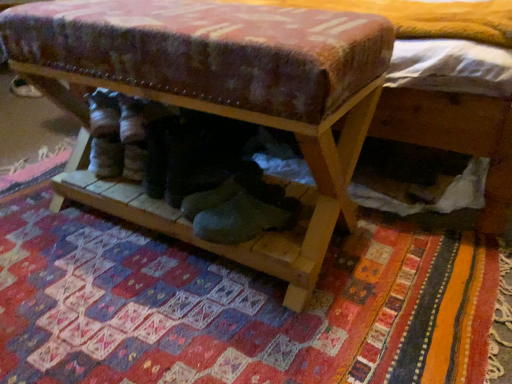
Question: Considering the relative positions of white suede shoe at lower left and wooden shoe rack at center in the image provided, is white suede shoe at lower left in front of wooden shoe rack at center?

Choices:
 (A) yes
 (B) no

Answer: (B)

Question: Considering the relative positions of white suede shoe at lower left and wooden shoe rack at center in the image provided, is white suede shoe at lower left to the right of wooden shoe rack at center from the viewer's perspective?

Choices:
 (A) yes
 (B) no

Answer: (B)

Question: From a real-world perspective, does white suede shoe at lower left stand above wooden shoe rack at center?

Choices:
 (A) yes
 (B) no

Answer: (B)

Question: Considering the relative sizes of white suede shoe at lower left and wooden shoe rack at center in the image provided, is white suede shoe at lower left bigger than wooden shoe rack at center?

Choices:
 (A) no
 (B) yes

Answer: (A)

Question: Is white suede shoe at lower left positioned beyond the bounds of wooden shoe rack at center?

Choices:
 (A) yes
 (B) no

Answer: (A)

Question: Does white suede shoe at lower left have a greater width compared to wooden shoe rack at center?

Choices:
 (A) no
 (B) yes

Answer: (A)

Question: Can you confirm if wooden shoe rack at center is positioned to the left of white suede shoe at lower left?

Choices:
 (A) yes
 (B) no

Answer: (B)

Question: Are wooden shoe rack at center and white suede shoe at lower left far apart?

Choices:
 (A) no
 (B) yes

Answer: (B)

Question: Is wooden shoe rack at center turned away from white suede shoe at lower left?

Choices:
 (A) yes
 (B) no

Answer: (B)

Question: Can you confirm if wooden shoe rack at center is shorter than white suede shoe at lower left?

Choices:
 (A) yes
 (B) no

Answer: (B)

Question: Considering the relative sizes of wooden shoe rack at center and white suede shoe at lower left in the image provided, is wooden shoe rack at center smaller than white suede shoe at lower left?

Choices:
 (A) no
 (B) yes

Answer: (A)

Question: Is wooden shoe rack at center outside of white suede shoe at lower left?

Choices:
 (A) no
 (B) yes

Answer: (B)

Question: Is wooden shoe rack at center at the left side of textured woolen mat at center?

Choices:
 (A) yes
 (B) no

Answer: (A)